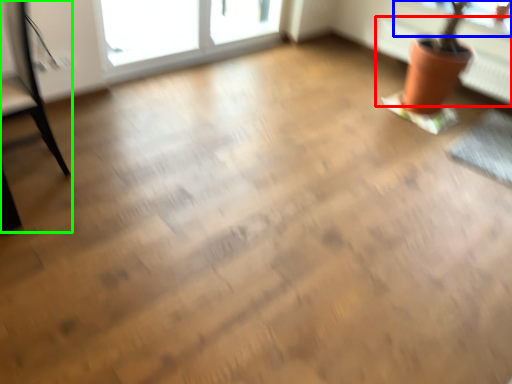
Question: Based on their relative distances, which object is nearer to radiator (highlighted by a red box)? Choose from window screen (highlighted by a blue box) and armchair (highlighted by a green box).

Choices:
 (A) window screen
 (B) armchair

Answer: (A)